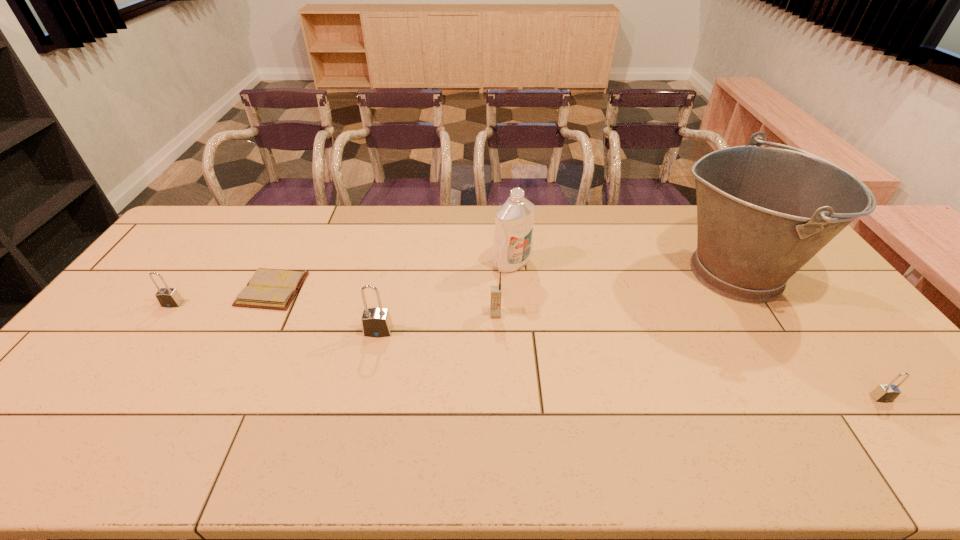
Image resolution: width=960 pixels, height=540 pixels. In order to click on unoccupied area between the tallest padlock and the cellular telephone in this screenshot , I will do tap(437, 323).

Where is `free area in between the diary and the shortest padlock`? free area in between the diary and the shortest padlock is located at coordinates (577, 343).

Locate an element on the screen. The image size is (960, 540). vacant space that is in between the cellular telephone and the sixth shortest object is located at coordinates (504, 289).

This screenshot has width=960, height=540. In order to click on vacant space in between the shortest object and the sixth shortest object in this screenshot , I will do `click(392, 276)`.

You are a GUI agent. You are given a task and a screenshot of the screen. Output one action in this format:
    pyautogui.click(x=<x>, y=<y>)
    Task: Click on the blank region between the cellular telephone and the sixth shortest object
    
    Given the screenshot: What is the action you would take?
    pyautogui.click(x=504, y=289)

I want to click on free space that is in between the diary and the bucket, so click(x=503, y=281).

Image resolution: width=960 pixels, height=540 pixels. What are the coordinates of `object that stands as the third closest to the cellular telephone` in the screenshot? It's located at click(763, 212).

You are a GUI agent. You are given a task and a screenshot of the screen. Output one action in this format:
    pyautogui.click(x=<x>, y=<y>)
    Task: Click on the object identified as the fourth closest to the leftmost padlock
    The height and width of the screenshot is (540, 960).
    Given the screenshot: What is the action you would take?
    pyautogui.click(x=513, y=241)

Find the location of a particular element. padlock that is the second closest to the cellular telephone is located at coordinates (167, 297).

Find the location of a particular element. This screenshot has height=540, width=960. padlock that is the closest to the sixth tallest object is located at coordinates (376, 322).